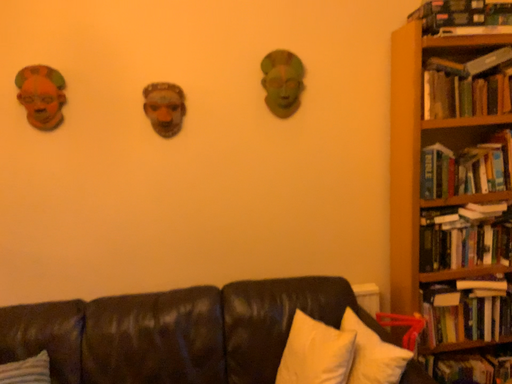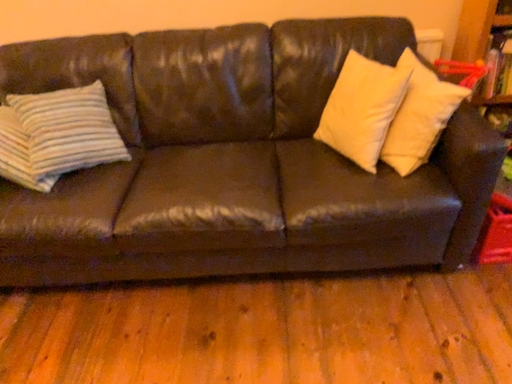
Question: How did the camera likely rotate when shooting the video?

Choices:
 (A) rotated upward
 (B) rotated downward

Answer: (B)